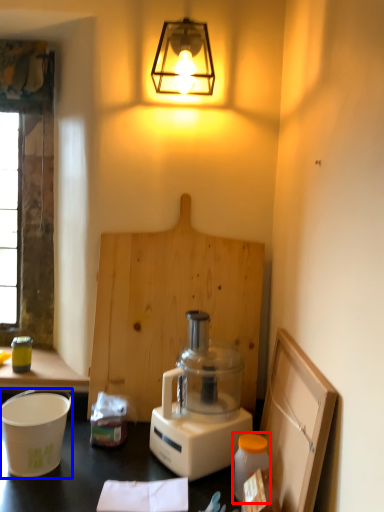
Question: Which point is closer to the camera, bottle (highlighted by a red box) or appliance (highlighted by a blue box)?

Choices:
 (A) bottle
 (B) appliance

Answer: (A)